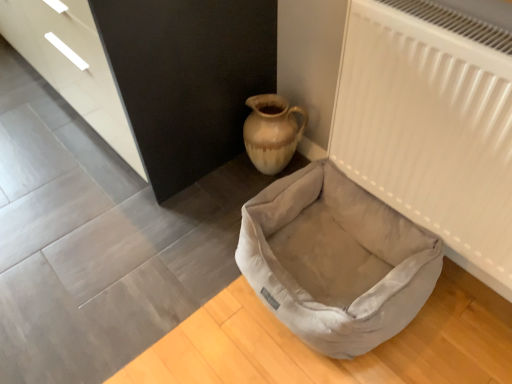
Question: Can you confirm if white matte radiator at upper right is bigger than matte black dresser at upper left?

Choices:
 (A) yes
 (B) no

Answer: (B)

Question: From a real-world perspective, is white matte radiator at upper right physically below matte black dresser at upper left?

Choices:
 (A) no
 (B) yes

Answer: (A)

Question: From the image's perspective, is white matte radiator at upper right located above matte black dresser at upper left?

Choices:
 (A) yes
 (B) no

Answer: (B)

Question: Considering the relative sizes of white matte radiator at upper right and matte black dresser at upper left in the image provided, is white matte radiator at upper right smaller than matte black dresser at upper left?

Choices:
 (A) yes
 (B) no

Answer: (A)

Question: Is white matte radiator at upper right positioned beyond the bounds of matte black dresser at upper left?

Choices:
 (A) yes
 (B) no

Answer: (A)

Question: Is matte beige ceramic vase at upper left wider or thinner than matte black dresser at upper left?

Choices:
 (A) wide
 (B) thin

Answer: (B)

Question: Is matte beige ceramic vase at upper left to the left or to the right of matte black dresser at upper left in the image?

Choices:
 (A) right
 (B) left

Answer: (A)

Question: Is point (298, 137) positioned closer to the camera than point (158, 48)?

Choices:
 (A) closer
 (B) farther

Answer: (B)

Question: Considering the positions of matte beige ceramic vase at upper left and matte black dresser at upper left in the image, is matte beige ceramic vase at upper left bigger or smaller than matte black dresser at upper left?

Choices:
 (A) small
 (B) big

Answer: (A)

Question: In terms of size, does matte black dresser at upper left appear bigger or smaller than white matte radiator at upper right?

Choices:
 (A) small
 (B) big

Answer: (B)

Question: Considering the positions of matte black dresser at upper left and white matte radiator at upper right in the image, is matte black dresser at upper left taller or shorter than white matte radiator at upper right?

Choices:
 (A) tall
 (B) short

Answer: (A)

Question: Relative to white matte radiator at upper right, is matte black dresser at upper left in front or behind?

Choices:
 (A) front
 (B) behind

Answer: (B)

Question: Looking at their shapes, would you say matte black dresser at upper left is wider or thinner than white matte radiator at upper right?

Choices:
 (A) thin
 (B) wide

Answer: (B)

Question: From a real-world perspective, is matte black dresser at upper left above or below velvet beige dog bed at lower center?

Choices:
 (A) above
 (B) below

Answer: (A)

Question: From their relative heights in the image, would you say matte black dresser at upper left is taller or shorter than velvet beige dog bed at lower center?

Choices:
 (A) tall
 (B) short

Answer: (A)